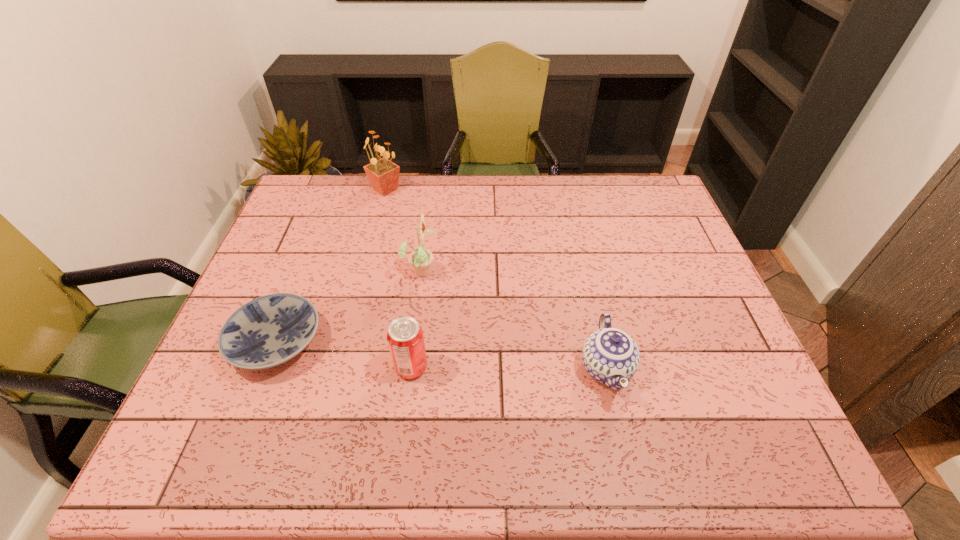
Image resolution: width=960 pixels, height=540 pixels. Find the location of `the fourth closest object to the rightmost object`. the fourth closest object to the rightmost object is located at coordinates (383, 174).

This screenshot has height=540, width=960. What are the coordinates of `blank space that satisfies the following two spatial constraints: 1. at the front of the third shortest object with flowers visible; 2. on the left side of the farther sunflower` in the screenshot? It's located at (340, 367).

You are a GUI agent. You are given a task and a screenshot of the screen. Output one action in this format:
    pyautogui.click(x=<x>, y=<y>)
    Task: Click on the vacant region that satisfies the following two spatial constraints: 1. on the front-facing side of the third shortest object; 2. on the right side of the fourth nearest object
    
    Given the screenshot: What is the action you would take?
    pyautogui.click(x=409, y=367)

This screenshot has height=540, width=960. I want to click on vacant space that satisfies the following two spatial constraints: 1. on the front-facing side of the third shortest object; 2. on the right side of the second farthest object, so [x=409, y=367].

At what (x,y) coordinates should I click in order to perform the action: click on vacant space that satisfies the following two spatial constraints: 1. on the back side of the third shortest object; 2. on the front-facing side of the nearer sunflower. Please return your answer as a coordinate pair (x, y). Image resolution: width=960 pixels, height=540 pixels. Looking at the image, I should click on (423, 271).